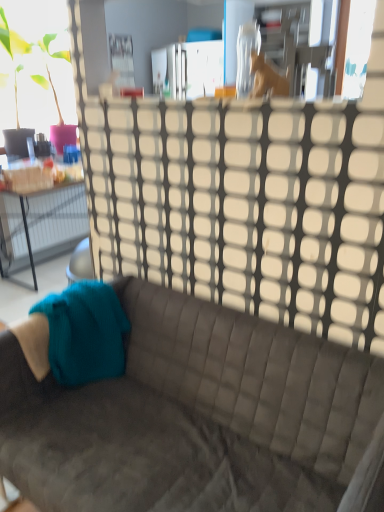
Question: From a real-world perspective, is wooden horse at upper center below teal knitted fabric at lower left?

Choices:
 (A) yes
 (B) no

Answer: (B)

Question: Is wooden horse at upper center looking in the opposite direction of teal knitted fabric at lower left?

Choices:
 (A) yes
 (B) no

Answer: (B)

Question: Does wooden horse at upper center contain teal knitted fabric at lower left?

Choices:
 (A) yes
 (B) no

Answer: (B)

Question: Can you confirm if wooden horse at upper center is shorter than teal knitted fabric at lower left?

Choices:
 (A) no
 (B) yes

Answer: (B)

Question: Are wooden horse at upper center and teal knitted fabric at lower left located far from each other?

Choices:
 (A) no
 (B) yes

Answer: (B)

Question: Looking at the image, does suede gray couch at center seem bigger or smaller compared to transparent plastic glass door at upper center?

Choices:
 (A) big
 (B) small

Answer: (A)

Question: From the image's perspective, is suede gray couch at center above or below transparent plastic glass door at upper center?

Choices:
 (A) above
 (B) below

Answer: (B)

Question: Considering the positions of point (365, 392) and point (109, 170), is point (365, 392) closer or farther from the camera than point (109, 170)?

Choices:
 (A) farther
 (B) closer

Answer: (B)

Question: Considering the positions of suede gray couch at center and transparent plastic glass door at upper center in the image, is suede gray couch at center wider or thinner than transparent plastic glass door at upper center?

Choices:
 (A) thin
 (B) wide

Answer: (B)

Question: From the image's perspective, is wooden horse at upper center located above or below teal knitted fabric at lower left?

Choices:
 (A) below
 (B) above

Answer: (B)

Question: From a real-world perspective, is wooden horse at upper center physically located above or below teal knitted fabric at lower left?

Choices:
 (A) below
 (B) above

Answer: (B)

Question: Considering the positions of wooden horse at upper center and teal knitted fabric at lower left in the image, is wooden horse at upper center wider or thinner than teal knitted fabric at lower left?

Choices:
 (A) wide
 (B) thin

Answer: (B)

Question: In terms of height, does wooden horse at upper center look taller or shorter compared to teal knitted fabric at lower left?

Choices:
 (A) tall
 (B) short

Answer: (B)

Question: Is teal knitted fabric at lower left bigger or smaller than transparent plastic glass door at upper center?

Choices:
 (A) small
 (B) big

Answer: (A)

Question: In terms of height, does teal knitted fabric at lower left look taller or shorter compared to transparent plastic glass door at upper center?

Choices:
 (A) short
 (B) tall

Answer: (A)